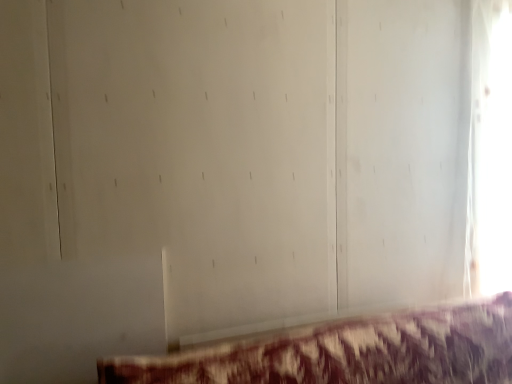
Question: In terms of width, does maroon fabric couch at lower center look wider or thinner when compared to transparent glass window at right?

Choices:
 (A) wide
 (B) thin

Answer: (A)

Question: From a real-world perspective, is maroon fabric couch at lower center positioned above or below transparent glass window at right?

Choices:
 (A) above
 (B) below

Answer: (B)

Question: Looking at the image, does maroon fabric couch at lower center seem bigger or smaller compared to transparent glass window at right?

Choices:
 (A) big
 (B) small

Answer: (A)

Question: Is transparent glass window at right wider or thinner than maroon fabric couch at lower center?

Choices:
 (A) wide
 (B) thin

Answer: (B)

Question: Is point (496, 198) closer or farther from the camera than point (476, 360)?

Choices:
 (A) closer
 (B) farther

Answer: (B)

Question: From a real-world perspective, relative to maroon fabric couch at lower center, is transparent glass window at right vertically above or below?

Choices:
 (A) below
 (B) above

Answer: (B)

Question: Is transparent glass window at right to the left or to the right of maroon fabric couch at lower center in the image?

Choices:
 (A) left
 (B) right

Answer: (B)